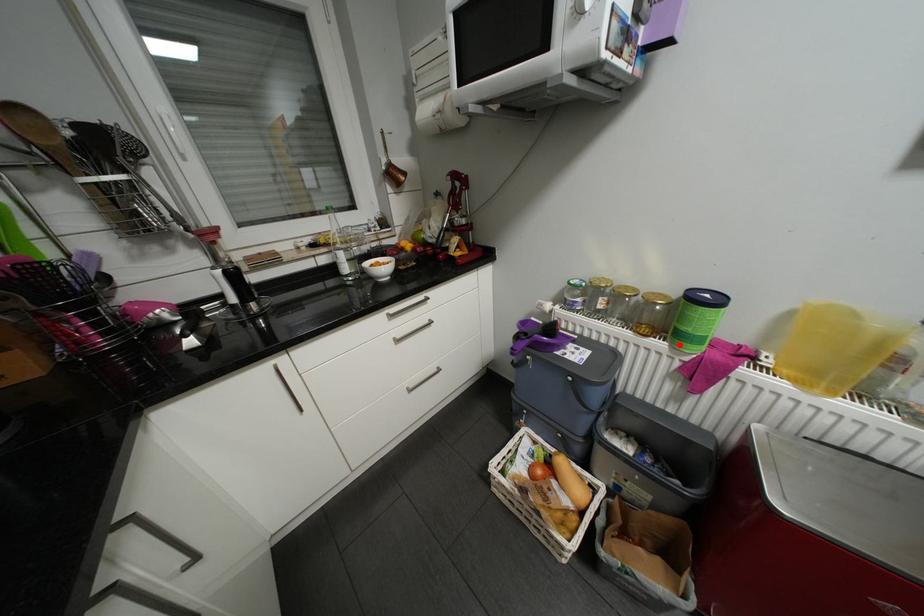
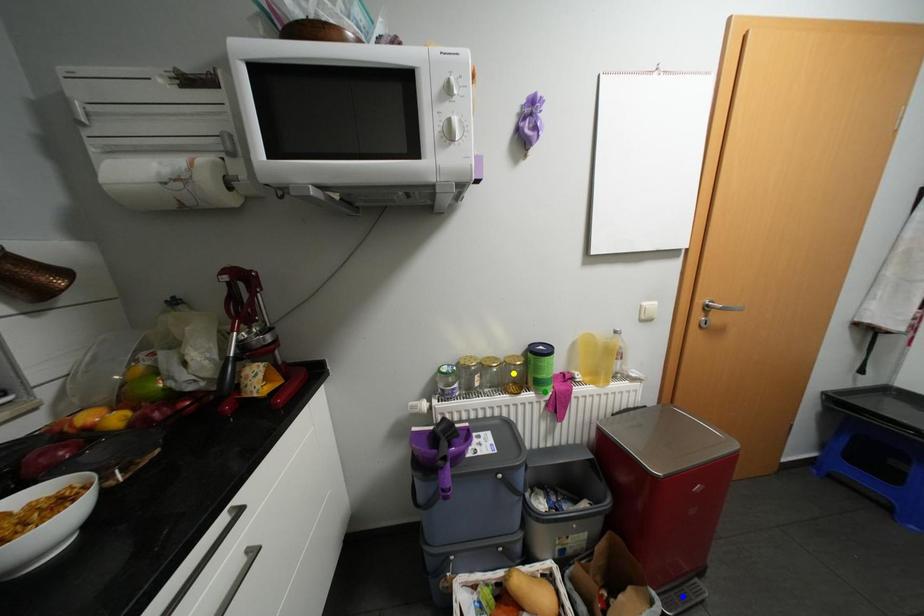
Question: I am providing you with two images of the same scene from different viewpoints. A red point is marked on the first image. You are given multiple points on the second image. Can you choose the point in image 2 that corresponds to the point in image 1?

Choices:
 (A) blue point
 (B) yellow point
 (C) green point

Answer: (C)